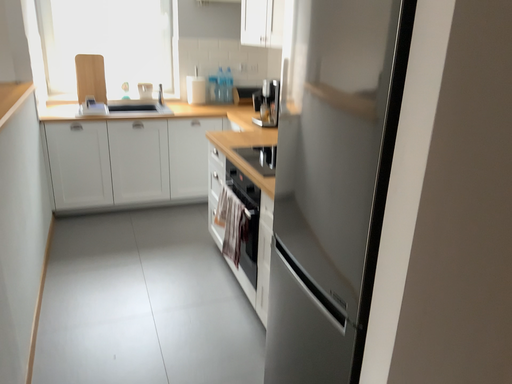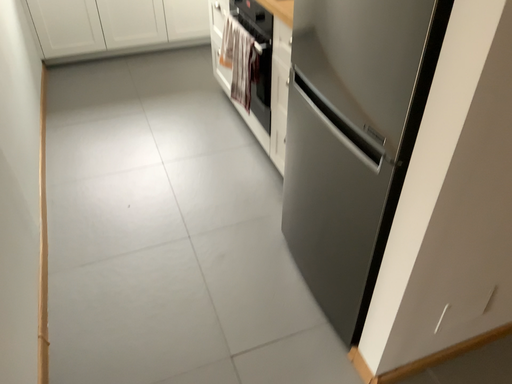
Question: How did the camera likely rotate when shooting the video?

Choices:
 (A) rotated upward
 (B) rotated downward

Answer: (B)